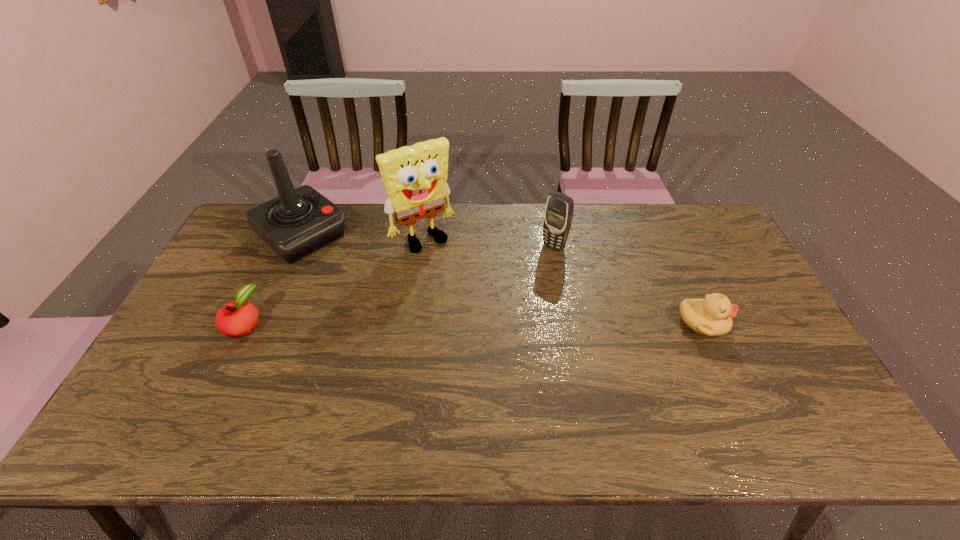
Locate an element on the screen. empty space that is in between the second object from right to left and the joystick is located at coordinates (428, 241).

In order to click on unoccupied position between the duckling and the cellular telephone in this screenshot , I will do `click(628, 285)`.

At what (x,y) coordinates should I click in order to perform the action: click on vacant area that lies between the joystick and the sponge. Please return your answer as a coordinate pair (x, y). The image size is (960, 540). Looking at the image, I should click on (363, 238).

The height and width of the screenshot is (540, 960). Find the location of `free space between the third object from right to left and the apple`. free space between the third object from right to left and the apple is located at coordinates (333, 281).

Find the location of `free point between the duckling and the shortest object`. free point between the duckling and the shortest object is located at coordinates (473, 323).

The height and width of the screenshot is (540, 960). Identify the location of free space between the third object from left to right and the rightmost object. (563, 281).

Identify the location of free space between the shortest object and the sponge. The image size is (960, 540). (333, 281).

Find the location of a particular element. Image resolution: width=960 pixels, height=540 pixels. free space that is in between the joystick and the sponge is located at coordinates (363, 238).

Locate an element on the screen. This screenshot has height=540, width=960. empty location between the third object from left to right and the joystick is located at coordinates (363, 238).

At what (x,y) coordinates should I click in order to perform the action: click on the fourth closest object relative to the joystick. Please return your answer as a coordinate pair (x, y). This screenshot has width=960, height=540. Looking at the image, I should click on (711, 316).